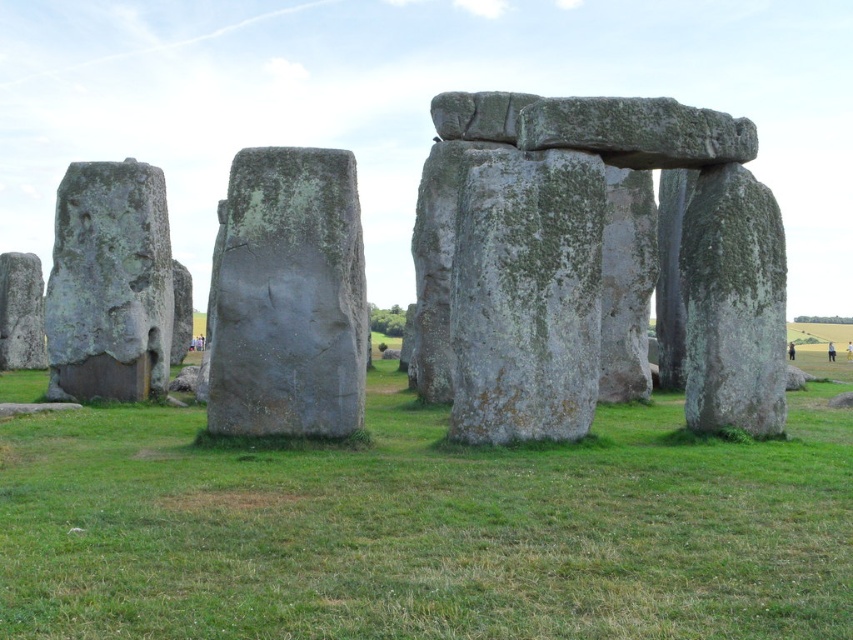
You are a tour guide at Stonehenge and want to point out the gray stone monoliths at center and the gray rough stone face at left to your visitors. Which of these two objects is bigger?

The gray stone monoliths at center is bigger than the gray rough stone face at left.

You are a tour guide at Stonehenge and want to point out the gray stone monoliths at center and the green mossy stone at center to your visitors. Which of these two objects is closer to the visitors standing at the entrance?

The gray stone monoliths at center are closer to the visitors because they are positioned in front of the green mossy stone at center.